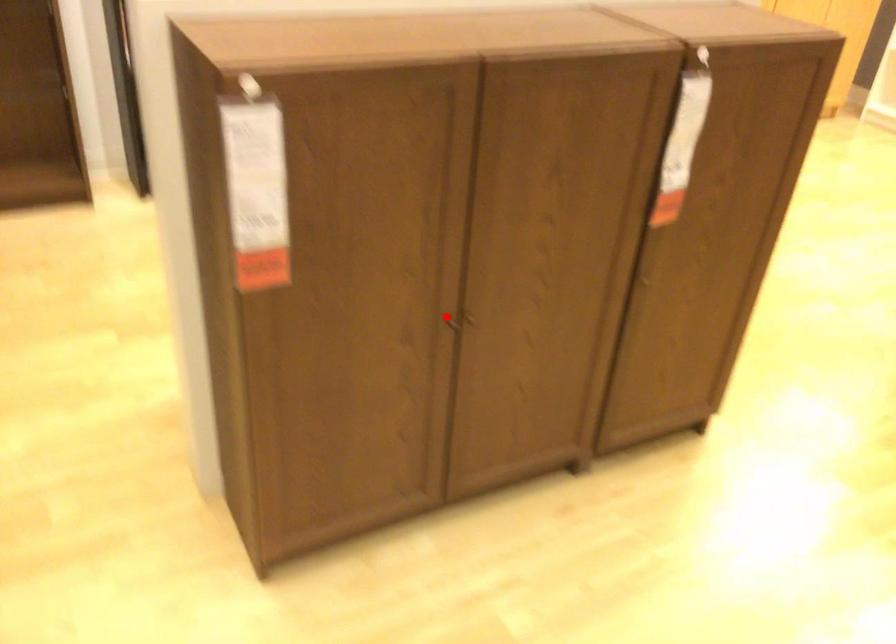
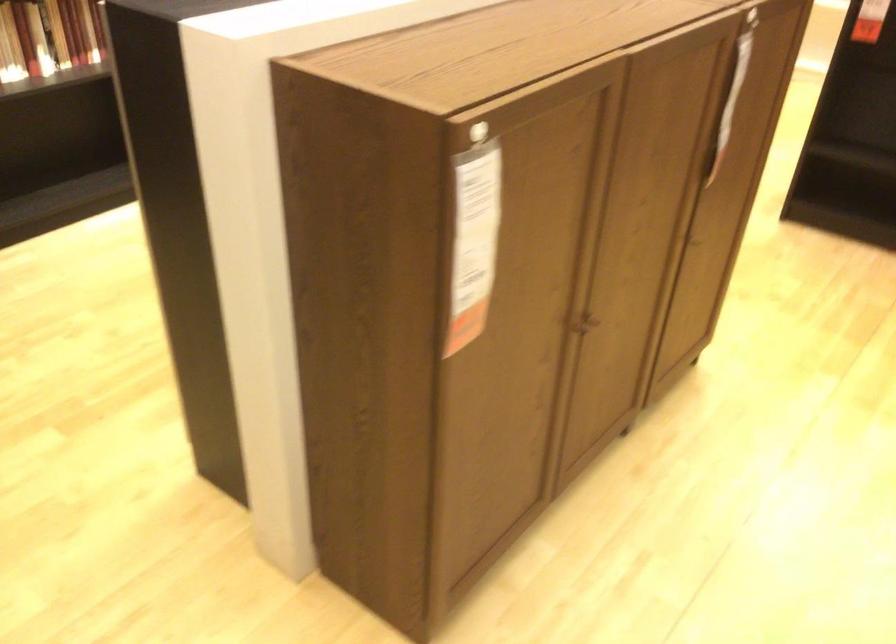
Where in the second image is the point corresponding to the highlighted location from the first image?

(583, 323)